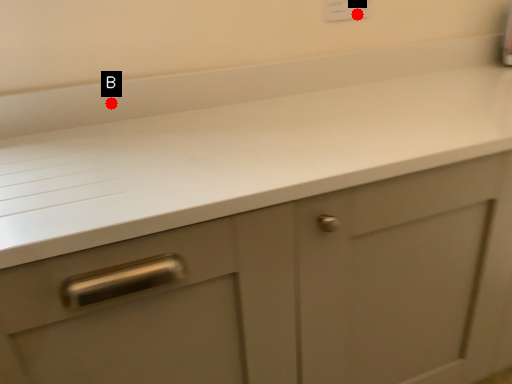
Question: Two points are circled on the image, labeled by A and B beside each circle. Which point is closer to the camera?

Choices:
 (A) A is closer
 (B) B is closer

Answer: (B)